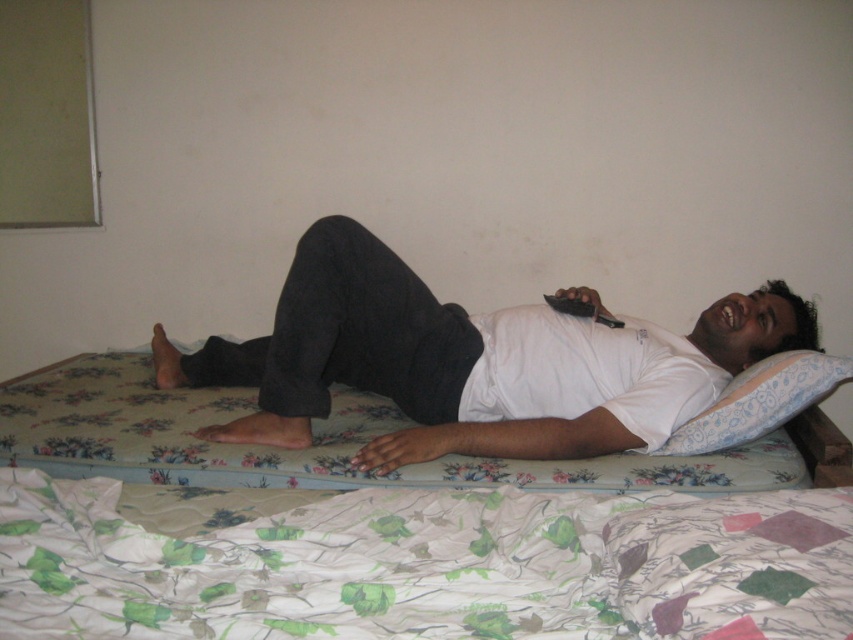
Question: Observing the image, what is the correct spatial positioning of green floral fabric at lower center in reference to floral fabric mattress at center?

Choices:
 (A) left
 (B) right

Answer: (B)

Question: Which of the following is the closest to the observer?

Choices:
 (A) (688, 433)
 (B) (328, 483)
 (C) (525, 348)
 (D) (575, 602)

Answer: (D)

Question: Which object is positioned farthest from the white matte shirt at center?

Choices:
 (A) floral fabric mattress at center
 (B) floral fabric pillow at upper right

Answer: (B)

Question: Does floral fabric mattress at center have a lesser width compared to floral fabric pillow at upper right?

Choices:
 (A) yes
 (B) no

Answer: (B)

Question: Among these points, which one is farthest from the camera?

Choices:
 (A) (692, 566)
 (B) (746, 396)
 (C) (761, 296)

Answer: (C)

Question: Does green floral fabric at lower center have a larger size compared to white matte shirt at center?

Choices:
 (A) yes
 (B) no

Answer: (B)